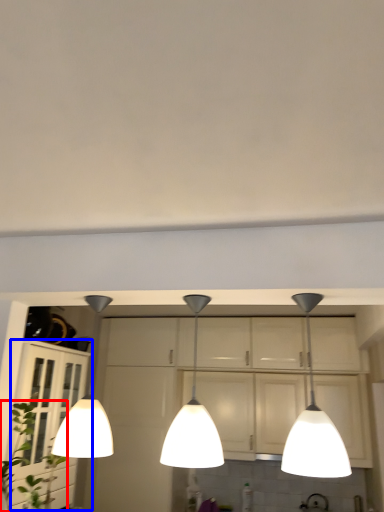
Question: Among these objects, which one is farthest to the camera, plant (highlighted by a red box) or cabinetry (highlighted by a blue box)?

Choices:
 (A) plant
 (B) cabinetry

Answer: (B)